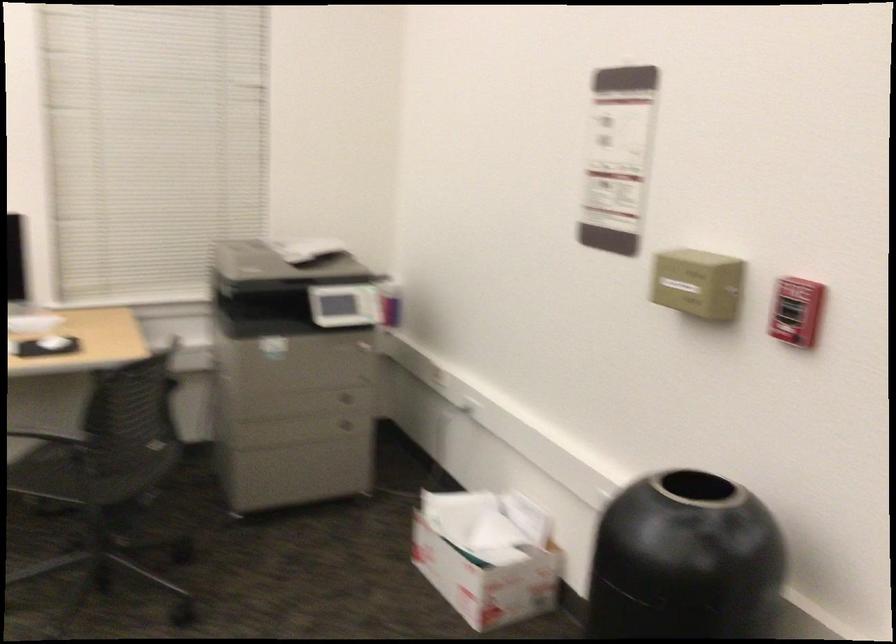
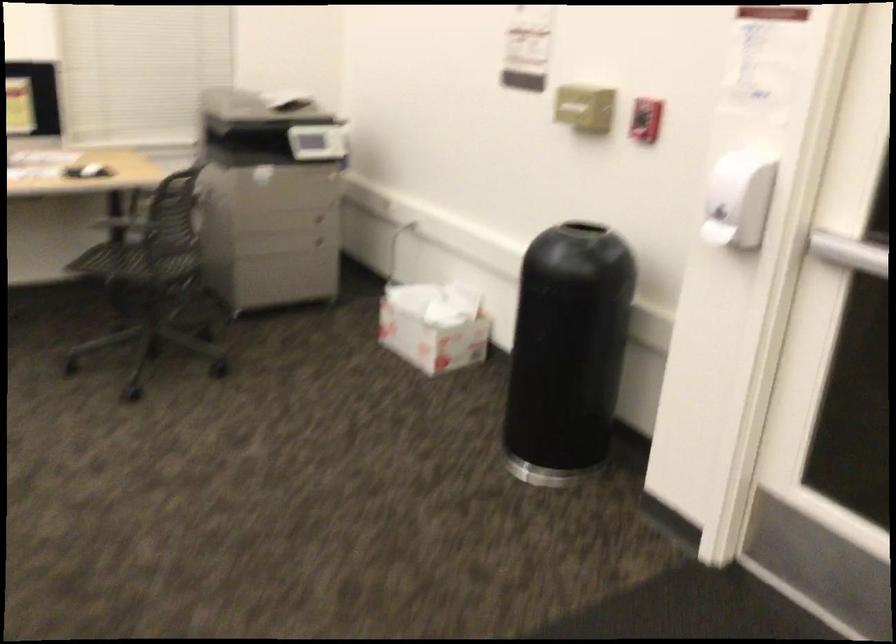
Question: Based on the continuous images, in which direction is the camera rotating? Reply with the corresponding letter.

Choices:
 (A) Left
 (B) Right
 (C) Up
 (D) Down

Answer: (D)